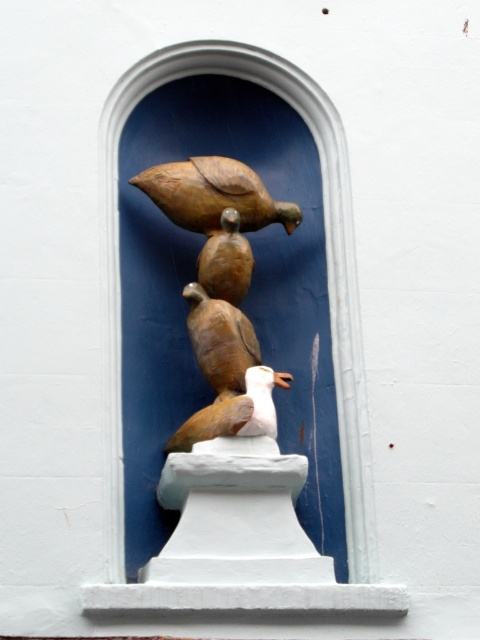
Who is positioned more to the right, brown matte bird at center or white matte bird at center?

From the viewer's perspective, white matte bird at center appears more on the right side.

Between brown matte bird at center and white matte bird at center, which one is positioned higher?

brown matte bird at center is above.

This screenshot has width=480, height=640. What do you see at coordinates (220, 339) in the screenshot?
I see `brown matte bird at center` at bounding box center [220, 339].

You are a GUI agent. You are given a task and a screenshot of the screen. Output one action in this format:
    pyautogui.click(x=<x>, y=<y>)
    Task: Click on the brown matte bird at center
    
    Given the screenshot: What is the action you would take?
    click(x=220, y=339)